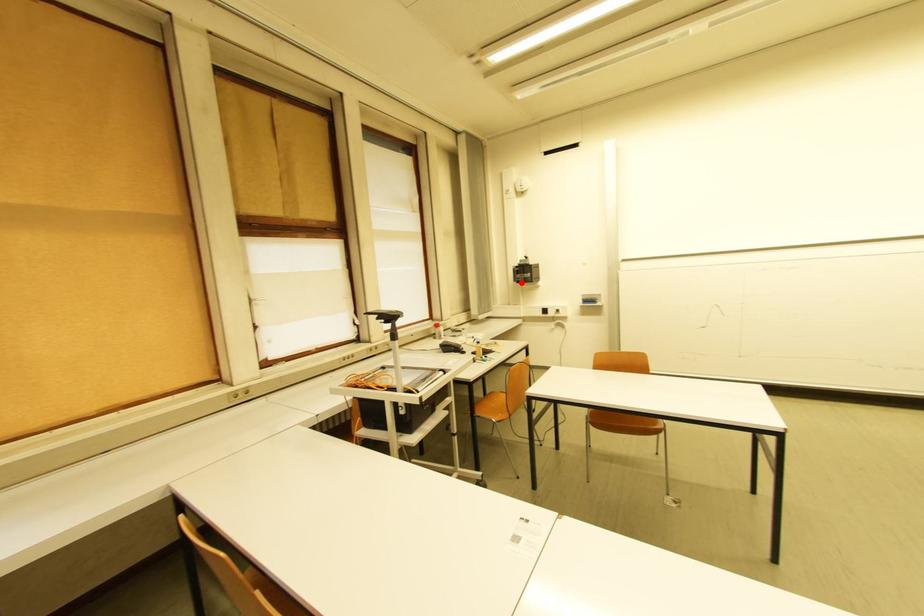
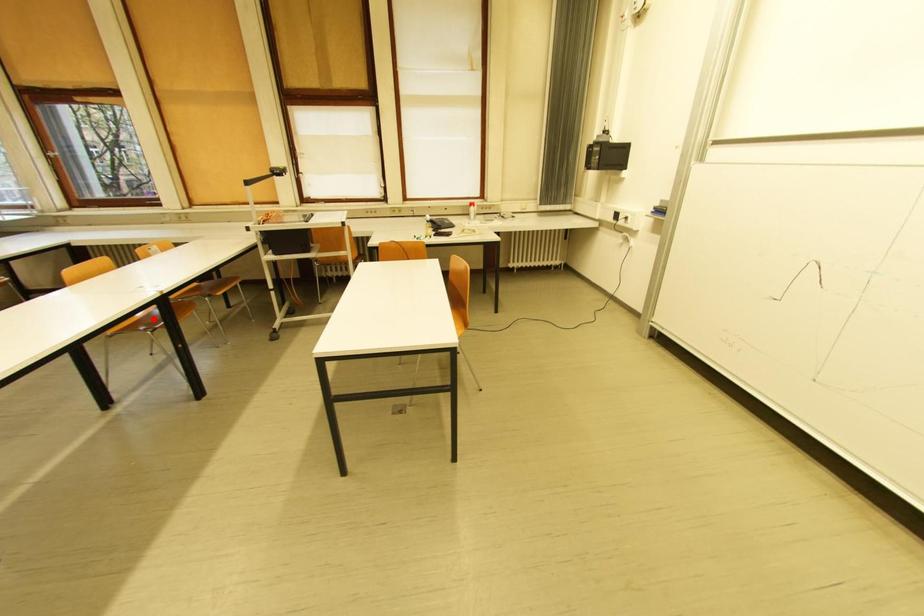
I am providing you with two images of the same scene from different viewpoints. A red point is marked on the first image and another point is marked on the second image. Are the points marked in image1 and image2 representing the same 3D position?

No